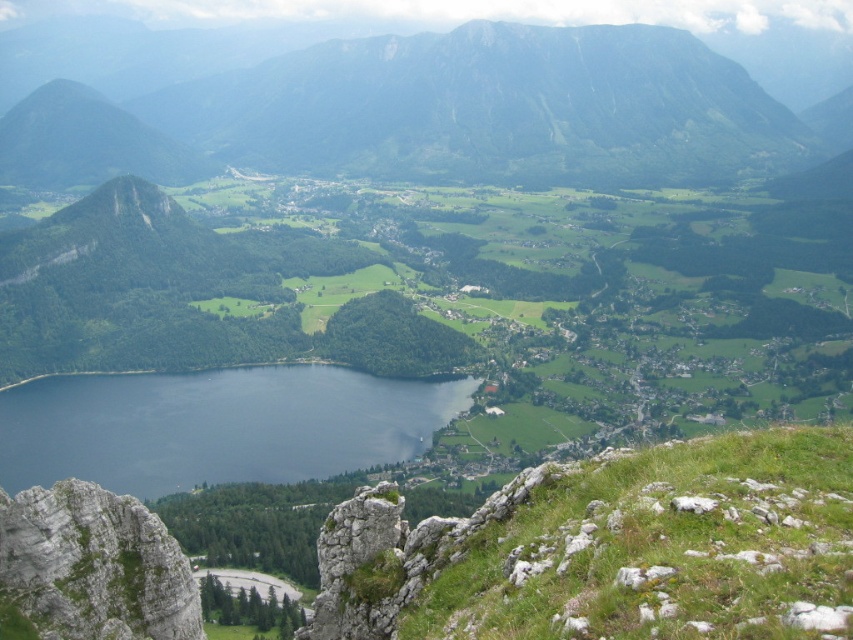
You are a hiker standing at the base of the valley looking towards the mountains. You see the green grassy mountain at upper center. Based on its coordinates, can you determine if it is located to the left or right of the center point of the image?

The green grassy mountain at upper center is located at coordinates point (x=490, y=106). Since the x coordinate is 0.166, which is less than 0.5, it is positioned to the left of the center point of the image.

You are standing at the viewpoint overlooking the valley and lake. You notice two points marked on a map. One is labeled as point (x=772, y=152) and the other as point (x=335, y=412). If you want to reach the point that is further away from you, which coordinate should you head towards?

Point (x=772, y=152) is behind point (x=335, y=412), so to reach the point further away from you, you should head towards point (x=772, y=152).

You are a hiker planning to descend from the green grassy mountain at upper center to the dark blue water at center. Based on the scene, which direction should you head to reach the water?

The green grassy mountain at upper center is taller than the dark blue water at center, so you should head downward from the green grassy mountain at upper center towards the dark blue water at center.